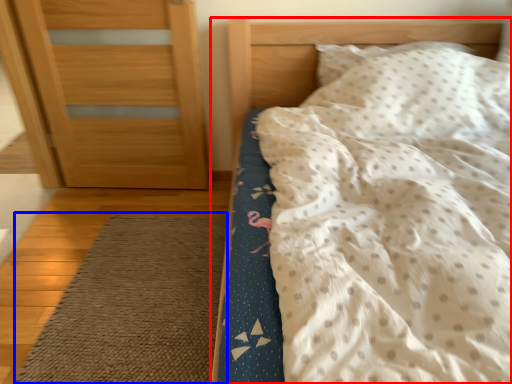
Question: Which of the following is the closest to the observer, bed (highlighted by a red box) or doormat (highlighted by a blue box)?

Choices:
 (A) bed
 (B) doormat

Answer: (A)